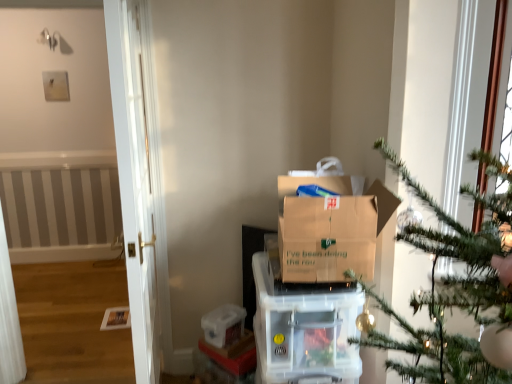
Where is `vacant space underneath transparent plastic container at lower center (from a real-world perspective)`? vacant space underneath transparent plastic container at lower center (from a real-world perspective) is located at coordinates (221, 331).